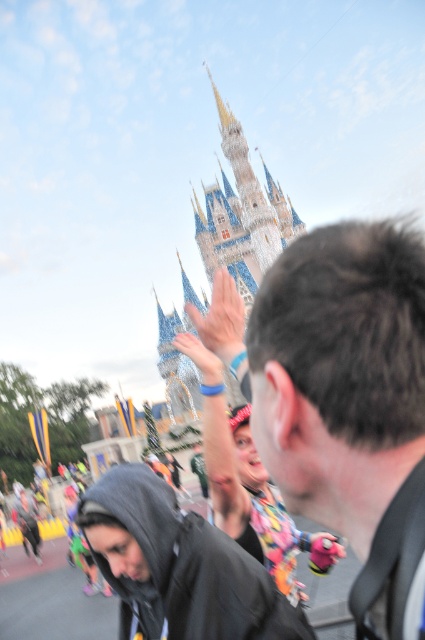
You are a photographer at the Disney theme park and want to capture a photo of the white stone castle at center without any foreground distractions. Based on the scene, is the black matte jacket at lower left blocking the view of the castle? Explain your reasoning.

The black matte jacket at lower left is to the left of the white stone castle at center, so it should not block the view of the castle from the photographer. The jacket is positioned to the side rather than directly in front, so the castle remains visible.

You are standing in the Disney theme park and see the dark brown hair at center and the white stone castle at center. Which object is positioned more to the right side of the scene?

The dark brown hair at center is positioned to the right of the white stone castle at center, so it is more to the right side of the scene.